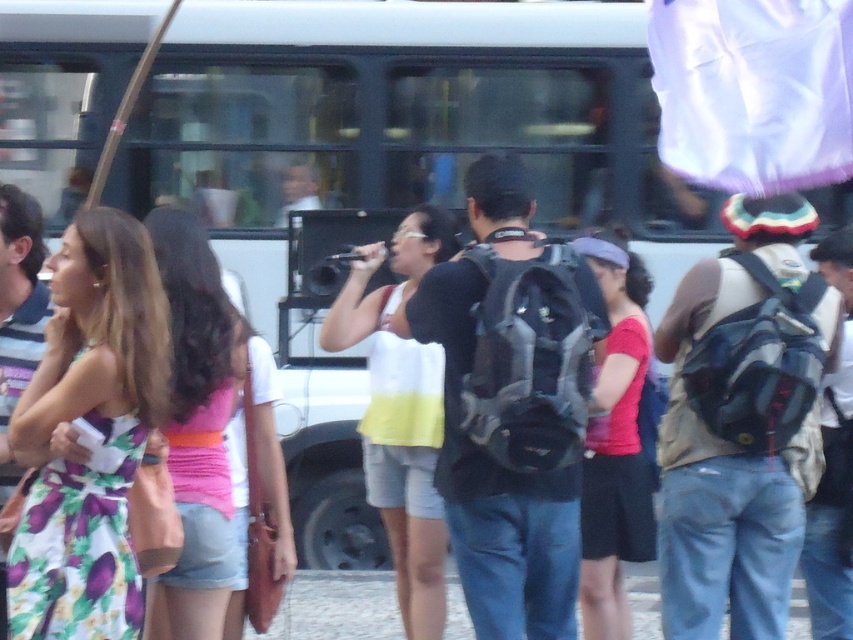
From the picture: You are standing at the back of the crowd and want to see the person holding the microphone better. Which clothing item should you look through first, the white cotton tank top at center or the matte red shirt at center?

The white cotton tank top at center is closer to you, so you should look through it first to see the person holding the microphone better.

You are a photographer standing in the crowd at the event. You want to take a photo of both the pink fabric top at center and the matte red shirt at center. Which one will appear larger in your photo?

The pink fabric top at center will appear larger in the photo because it is closer to the viewer than the matte red shirt at center.